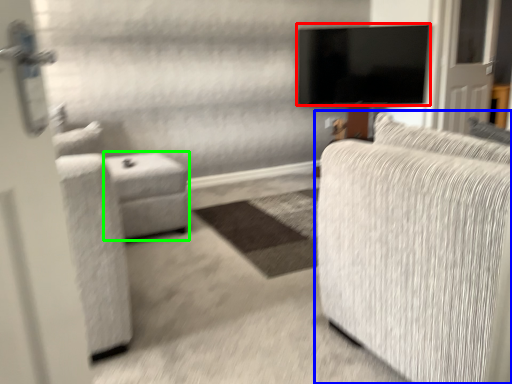
Question: Which object is the closest to the television (highlighted by a red box)? Choose among these: studio couch (highlighted by a blue box) or table (highlighted by a green box).

Choices:
 (A) studio couch
 (B) table

Answer: (B)